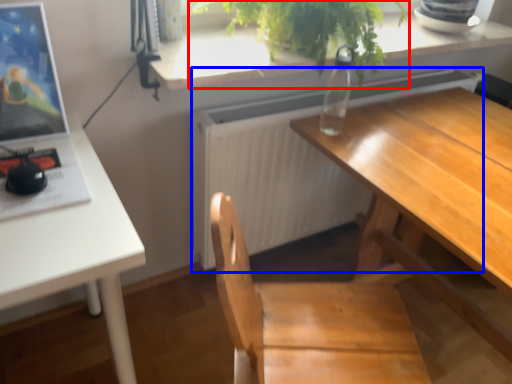
Question: Which object appears farthest to the camera in this image, houseplant (highlighted by a red box) or radiator (highlighted by a blue box)?

Choices:
 (A) houseplant
 (B) radiator

Answer: (B)